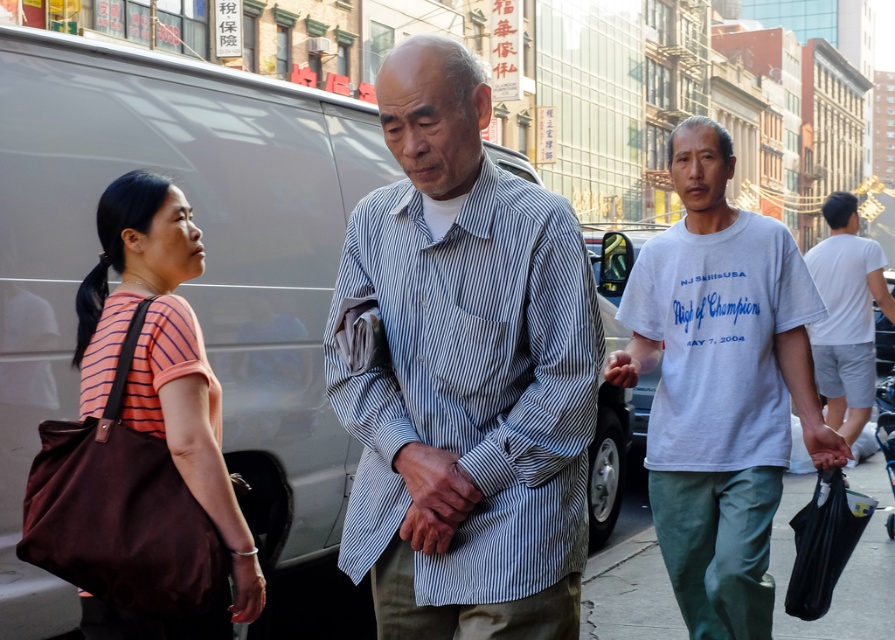
Question: Which point is farther to the camera?

Choices:
 (A) (716, 634)
 (B) (853, 276)
 (C) (771, 541)

Answer: (B)

Question: Which point is farther to the camera?

Choices:
 (A) (802, 496)
 (B) (150, 221)
 (C) (814, 353)

Answer: (A)

Question: Which object appears farthest from the camera in this image?

Choices:
 (A) matte brown tote bag at left
 (B) striped cotton shirt at center
 (C) white cotton t-shirt at center-right
 (D) white cotton t-shirt at right

Answer: (D)

Question: Observing the image, what is the correct spatial positioning of white cotton t-shirt at center-right in reference to white cotton t-shirt at right?

Choices:
 (A) left
 (B) right

Answer: (A)

Question: Is matte brown tote bag at left to the left of white cotton t-shirt at right from the viewer's perspective?

Choices:
 (A) no
 (B) yes

Answer: (B)

Question: Does white cotton t-shirt at center-right have a lesser width compared to green fabric pants at lower right?

Choices:
 (A) no
 (B) yes

Answer: (A)